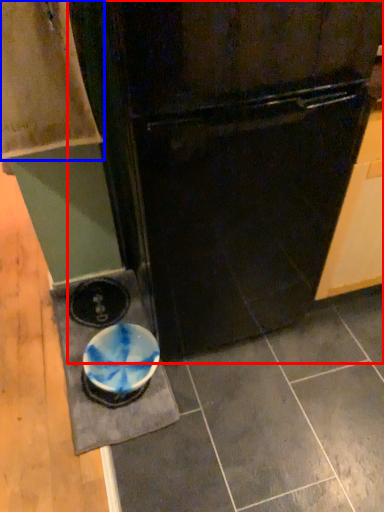
Question: Which object appears closest to the camera in this image, refrigerator (highlighted by a red box) or cabinetry (highlighted by a blue box)?

Choices:
 (A) refrigerator
 (B) cabinetry

Answer: (A)